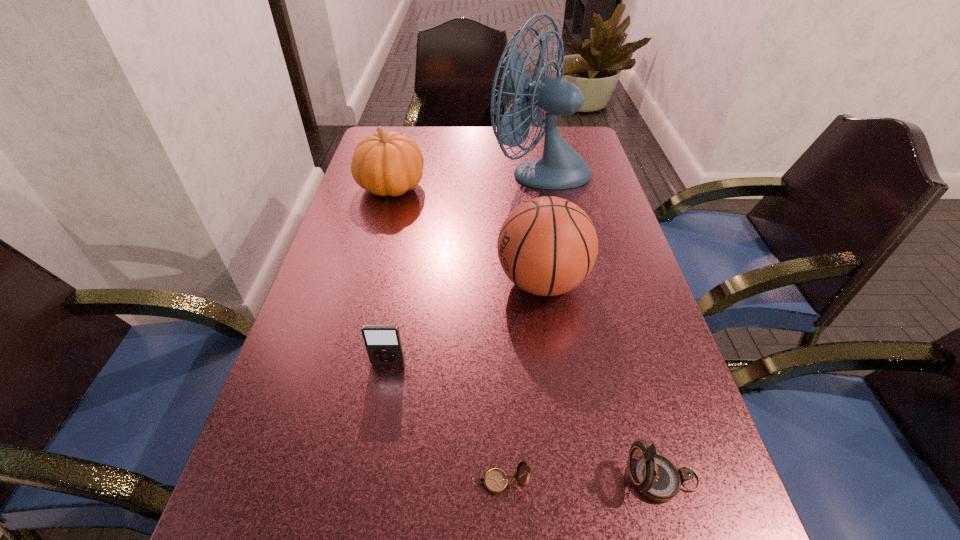
You are a GUI agent. You are given a task and a screenshot of the screen. Output one action in this format:
    pyautogui.click(x=<x>, y=<y>)
    Task: Click on the free space located on the surface of the basketball near the brand logo
    
    Given the screenshot: What is the action you would take?
    pyautogui.click(x=469, y=282)

You are a GUI agent. You are given a task and a screenshot of the screen. Output one action in this format:
    pyautogui.click(x=<x>, y=<y>)
    Task: Click on the vacant space situated on the surface of the basketball near the brand logo
    Image resolution: width=960 pixels, height=540 pixels.
    Given the screenshot: What is the action you would take?
    pyautogui.click(x=430, y=282)

You are a GUI agent. You are given a task and a screenshot of the screen. Output one action in this format:
    pyautogui.click(x=<x>, y=<y>)
    Task: Click on the free location located on the surface of the basketball near the brand logo
    
    Given the screenshot: What is the action you would take?
    pyautogui.click(x=396, y=282)

This screenshot has height=540, width=960. I want to click on free space located on the front of the pumpkin, so click(383, 218).

Locate an element on the screen. The image size is (960, 540). free spot located 0.290m on the front-facing side of the iPod is located at coordinates (357, 535).

Where is `free space located on the face of the taller compass`? free space located on the face of the taller compass is located at coordinates (434, 480).

In order to click on free space located 0.380m on the face of the taller compass in this screenshot , I will do `click(383, 480)`.

Find the location of a particular element. This screenshot has height=540, width=960. free space located 0.150m on the face of the taller compass is located at coordinates (530, 480).

Identify the location of vacant space located on the face of the shorter compass. The width and height of the screenshot is (960, 540). (389, 482).

The width and height of the screenshot is (960, 540). Find the location of `vacant space located on the face of the shorter compass`. vacant space located on the face of the shorter compass is located at coordinates (292, 482).